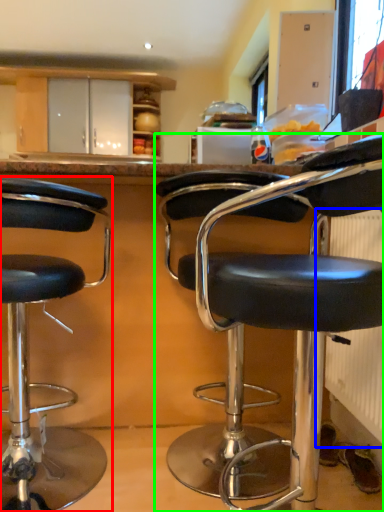
Question: Which object is positioned closest to chair (highlighted by a red box)? Select from radiator (highlighted by a blue box) and chair (highlighted by a green box).

Choices:
 (A) radiator
 (B) chair

Answer: (B)